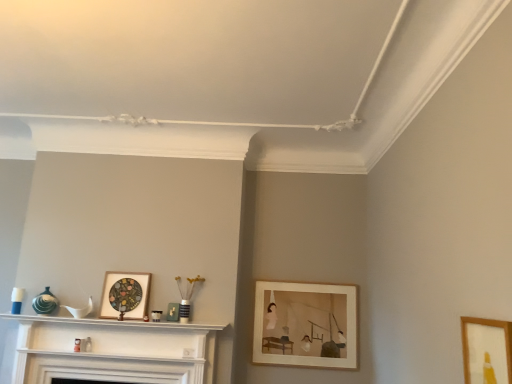
Question: Should I look upward or downward to see wooden picture frame at lower right, which is counted as the third picture frame, starting from the left?

Choices:
 (A) up
 (B) down

Answer: (B)

Question: Does white glossy fireplace at center appear on the right side of wooden picture frame at lower right, which is counted as the 1th picture frame, starting from the right?

Choices:
 (A) yes
 (B) no

Answer: (B)

Question: From a real-world perspective, is white glossy fireplace at center below wooden picture frame at lower right, which is counted as the 1th picture frame, starting from the right?

Choices:
 (A) no
 (B) yes

Answer: (B)

Question: Considering the relative sizes of white glossy fireplace at center and wooden picture frame at lower right, which is counted as the 1th picture frame, starting from the right, in the image provided, is white glossy fireplace at center thinner than wooden picture frame at lower right, which is counted as the 1th picture frame, starting from the right,?

Choices:
 (A) yes
 (B) no

Answer: (B)

Question: Can you confirm if white glossy fireplace at center is smaller than wooden picture frame at lower right, which is counted as the third picture frame, starting from the left?

Choices:
 (A) yes
 (B) no

Answer: (B)

Question: Is white glossy fireplace at center positioned beyond the bounds of wooden picture frame at lower right, which is the first picture frame in front-to-back order?

Choices:
 (A) yes
 (B) no

Answer: (A)

Question: Is white glossy fireplace at center wider than wooden picture frame at lower right, placed as the third picture frame when sorted from back to front?

Choices:
 (A) no
 (B) yes

Answer: (B)

Question: Considering the relative positions of wooden picture frame at center-right, the first picture frame when ordered from back to front, and wooden picture frame at lower right, which is counted as the 1th picture frame, starting from the right, in the image provided, is wooden picture frame at center-right, the first picture frame when ordered from back to front, behind wooden picture frame at lower right, which is counted as the 1th picture frame, starting from the right,?

Choices:
 (A) no
 (B) yes

Answer: (B)

Question: From a real-world perspective, is wooden picture frame at center-right, the first picture frame when ordered from back to front, below wooden picture frame at lower right, which is counted as the 1th picture frame, starting from the right?

Choices:
 (A) no
 (B) yes

Answer: (B)

Question: Is wooden picture frame at center-right, the first picture frame when ordered from back to front, taller than wooden picture frame at lower right, placed as the third picture frame when sorted from back to front?

Choices:
 (A) no
 (B) yes

Answer: (B)

Question: Could you tell me if wooden picture frame at center-right, acting as the 3th picture frame starting from the front, is turned towards wooden picture frame at lower right, which is the first picture frame in front-to-back order?

Choices:
 (A) no
 (B) yes

Answer: (B)

Question: Does wooden picture frame at center-right, the first picture frame when ordered from back to front, appear on the right side of wooden picture frame at lower right, which is counted as the 1th picture frame, starting from the right?

Choices:
 (A) no
 (B) yes

Answer: (A)

Question: Is wooden picture frame at center-right, the 2th picture frame from the right, smaller than wooden picture frame at lower right, which is counted as the 1th picture frame, starting from the right?

Choices:
 (A) no
 (B) yes

Answer: (A)

Question: From a real-world perspective, is wooden picture frame at center-right, the 2th picture frame from the right, on white glossy fireplace at center?

Choices:
 (A) yes
 (B) no

Answer: (A)